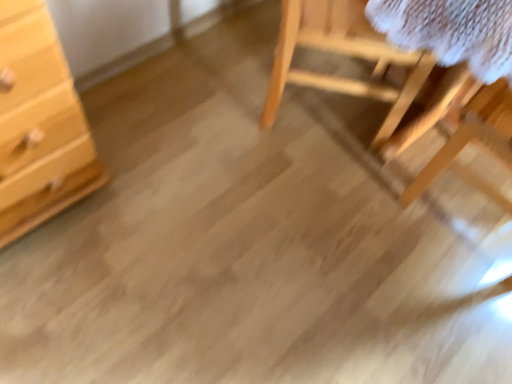
Where is `unoccupied area in front of wooden table at right`? Image resolution: width=512 pixels, height=384 pixels. unoccupied area in front of wooden table at right is located at coordinates (440, 306).